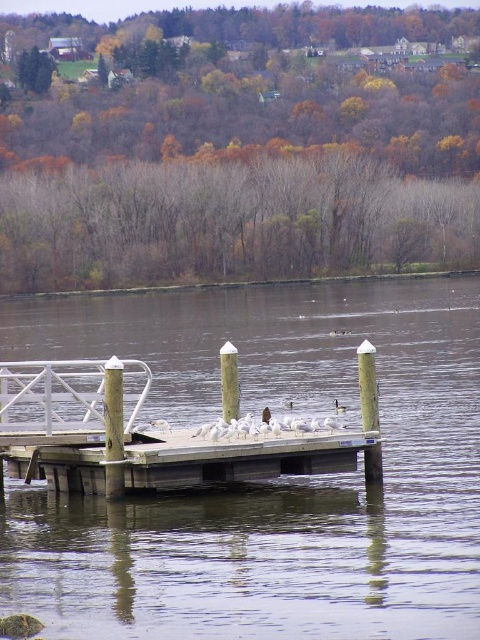
Question: Observing the image, what is the correct spatial positioning of white painted wood post at center in reference to smooth gray post at center?

Choices:
 (A) above
 (B) below

Answer: (B)

Question: Which of the following is the farthest from the observer?

Choices:
 (A) smooth gray post at center
 (B) white painted wood post at center
 (C) white plastic pole at center
 (D) brown matte duck at center

Answer: (D)

Question: Which object is closer to the camera taking this photo?

Choices:
 (A) brown matte duck at center
 (B) white plastic pole at center
 (C) wooden dock at center
 (D) white painted wood post at center

Answer: (D)

Question: Can you confirm if transparent wooden dock at center is positioned below white painted wood post at center?

Choices:
 (A) no
 (B) yes

Answer: (A)

Question: Which point is farther to the camera?

Choices:
 (A) white painted wood post at center
 (B) smooth gray post at center
 (C) white plastic pole at center

Answer: (C)

Question: Can you confirm if wooden dock at center is wider than smooth gray post at center?

Choices:
 (A) no
 (B) yes

Answer: (B)